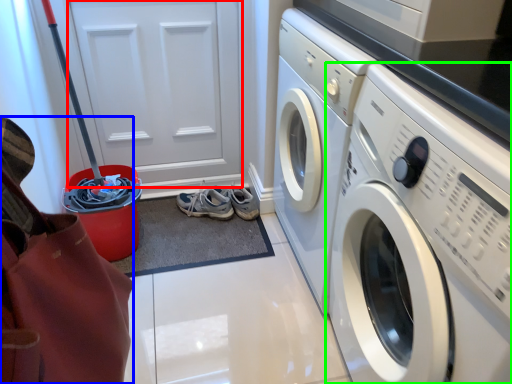
Question: Estimate the real-world distances between objects in this image. Which object is farther from door (highlighted by a red box), material (highlighted by a blue box) or washing machine (highlighted by a green box)?

Choices:
 (A) material
 (B) washing machine

Answer: (A)